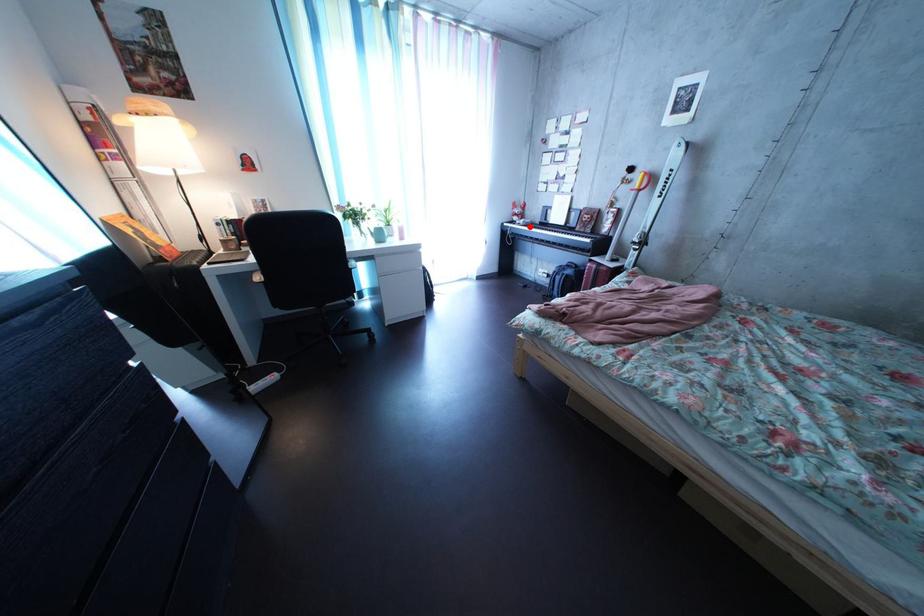
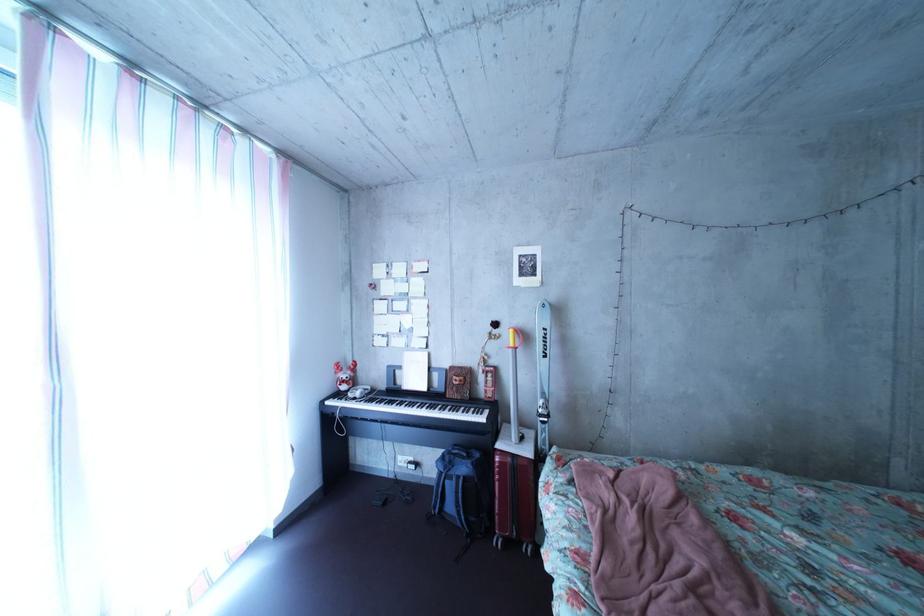
Question: I am providing you with two images of the same scene from different viewpoints. In image1, a red point is highlighted. Considering the same 3D point in image2, which of the following is correct?

Choices:
 (A) It is closer
 (B) It is farther

Answer: (B)